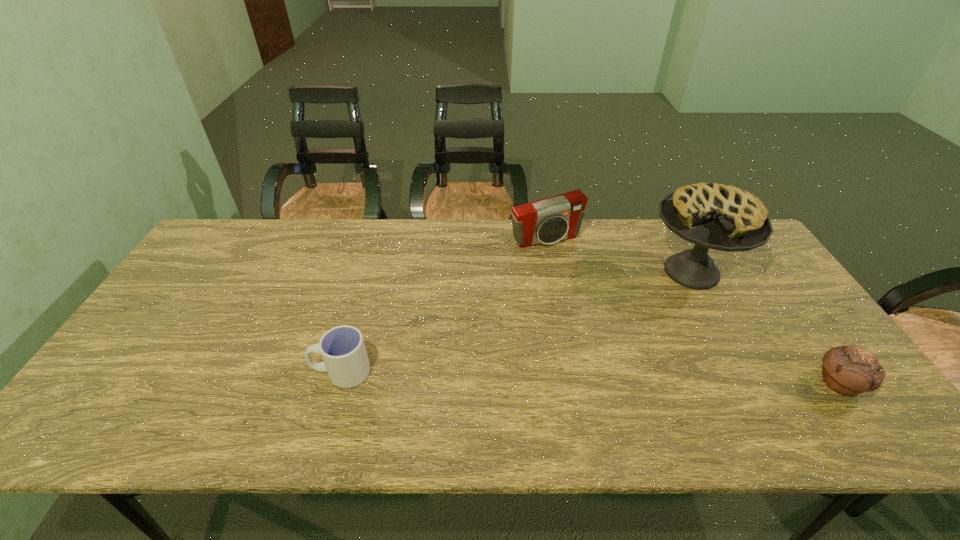
Locate an element on the screen. The height and width of the screenshot is (540, 960). the leftmost object is located at coordinates (342, 348).

Locate an element on the screen. The width and height of the screenshot is (960, 540). muffin is located at coordinates (848, 370).

Find the location of a particular element. Image resolution: width=960 pixels, height=540 pixels. pie is located at coordinates (714, 216).

Locate an element on the screen. the tallest object is located at coordinates (714, 216).

At what (x,y) coordinates should I click in order to perform the action: click on camera. Please return your answer as a coordinate pair (x, y). This screenshot has width=960, height=540. Looking at the image, I should click on (547, 221).

You are a GUI agent. You are given a task and a screenshot of the screen. Output one action in this format:
    pyautogui.click(x=<x>, y=<y>)
    Task: Click on the third object from right to left
    The image size is (960, 540).
    Given the screenshot: What is the action you would take?
    pyautogui.click(x=547, y=221)

Where is `vacant area located 0.340m with the handle on the side of the cup`? Image resolution: width=960 pixels, height=540 pixels. vacant area located 0.340m with the handle on the side of the cup is located at coordinates (174, 372).

You are a GUI agent. You are given a task and a screenshot of the screen. Output one action in this format:
    pyautogui.click(x=<x>, y=<y>)
    Task: Click on the free region located 0.400m with the handle on the side of the cup
    The image size is (960, 540).
    Given the screenshot: What is the action you would take?
    pyautogui.click(x=149, y=372)

You are a GUI agent. You are given a task and a screenshot of the screen. Output one action in this format:
    pyautogui.click(x=<x>, y=<y>)
    Task: Click on the vacant area situated 0.370m with the handle on the side of the cup
    
    Given the screenshot: What is the action you would take?
    click(161, 372)

Image resolution: width=960 pixels, height=540 pixels. Find the location of `vacant region located 0.100m on the back of the muffin`. vacant region located 0.100m on the back of the muffin is located at coordinates (804, 333).